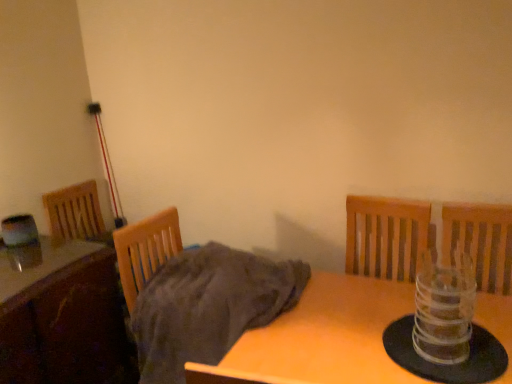
Question: Considering the relative positions of transparent plastic candle holder at right and wooden table at center, marked as the second table in a left-to-right arrangement, in the image provided, is transparent plastic candle holder at right to the left of wooden table at center, marked as the second table in a left-to-right arrangement, from the viewer's perspective?

Choices:
 (A) no
 (B) yes

Answer: (A)

Question: Is transparent plastic candle holder at right bigger than wooden table at center, marked as the second table in a left-to-right arrangement?

Choices:
 (A) no
 (B) yes

Answer: (A)

Question: From the image's perspective, would you say transparent plastic candle holder at right is shown under wooden table at center, marked as the second table in a left-to-right arrangement?

Choices:
 (A) no
 (B) yes

Answer: (A)

Question: Is transparent plastic candle holder at right further to camera compared to wooden table at center, which is the 1th table in right-to-left order?

Choices:
 (A) yes
 (B) no

Answer: (A)

Question: Considering the relative sizes of transparent plastic candle holder at right and wooden table at center, which is the 1th table in right-to-left order, in the image provided, is transparent plastic candle holder at right thinner than wooden table at center, which is the 1th table in right-to-left order,?

Choices:
 (A) no
 (B) yes

Answer: (B)

Question: Considering the relative positions of wooden table at center, which is the 1th table in right-to-left order, and wooden table at lower left, which appears as the 1th table when viewed from the left, in the image provided, is wooden table at center, which is the 1th table in right-to-left order, to the left or to the right of wooden table at lower left, which appears as the 1th table when viewed from the left,?

Choices:
 (A) right
 (B) left

Answer: (A)

Question: In the image, is wooden table at center, marked as the second table in a left-to-right arrangement, positioned in front of or behind wooden table at lower left, which appears as the 1th table when viewed from the left?

Choices:
 (A) behind
 (B) front

Answer: (B)

Question: In terms of size, does wooden table at center, which is the 1th table in right-to-left order, appear bigger or smaller than wooden table at lower left, positioned as the 2th table in right-to-left order?

Choices:
 (A) small
 (B) big

Answer: (B)

Question: Which is correct: wooden table at center, which is the 1th table in right-to-left order, is inside wooden table at lower left, which appears as the 1th table when viewed from the left, or outside of it?

Choices:
 (A) outside
 (B) inside

Answer: (A)

Question: Choose the correct answer: Is transparent plastic candle holder at right inside wooden table at lower left, which appears as the 1th table when viewed from the left, or outside it?

Choices:
 (A) inside
 (B) outside

Answer: (B)

Question: Considering the positions of transparent plastic candle holder at right and wooden table at lower left, positioned as the 2th table in right-to-left order, in the image, is transparent plastic candle holder at right wider or thinner than wooden table at lower left, positioned as the 2th table in right-to-left order,?

Choices:
 (A) wide
 (B) thin

Answer: (B)

Question: From their relative heights in the image, would you say transparent plastic candle holder at right is taller or shorter than wooden table at lower left, which appears as the 1th table when viewed from the left?

Choices:
 (A) short
 (B) tall

Answer: (A)

Question: From the image's perspective, is transparent plastic candle holder at right above or below wooden table at lower left, positioned as the 2th table in right-to-left order?

Choices:
 (A) below
 (B) above

Answer: (B)

Question: Is point (200, 289) positioned closer to the camera than point (449, 311)?

Choices:
 (A) closer
 (B) farther

Answer: (B)

Question: From their relative heights in the image, would you say gray cotton blanket at center is taller or shorter than transparent plastic candle holder at right?

Choices:
 (A) tall
 (B) short

Answer: (A)